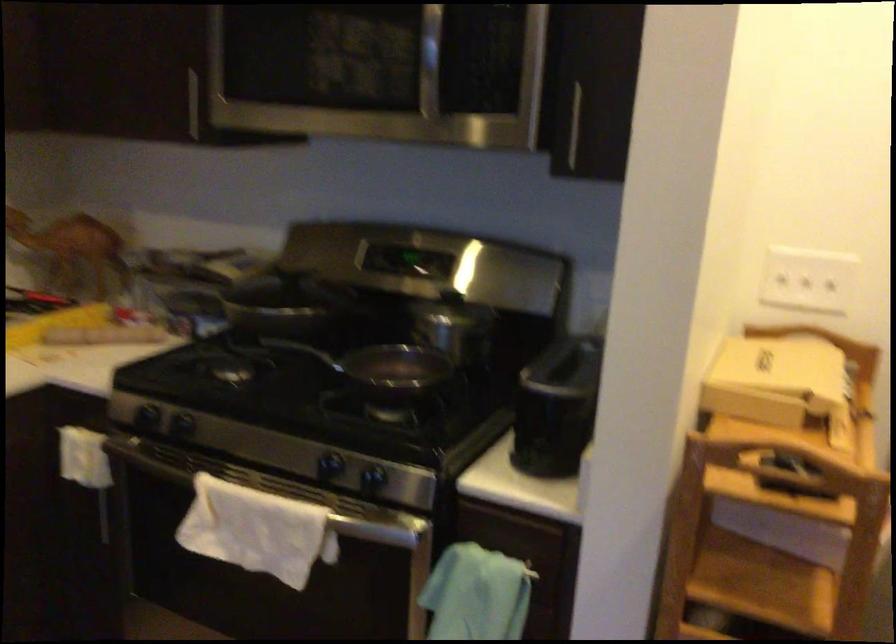
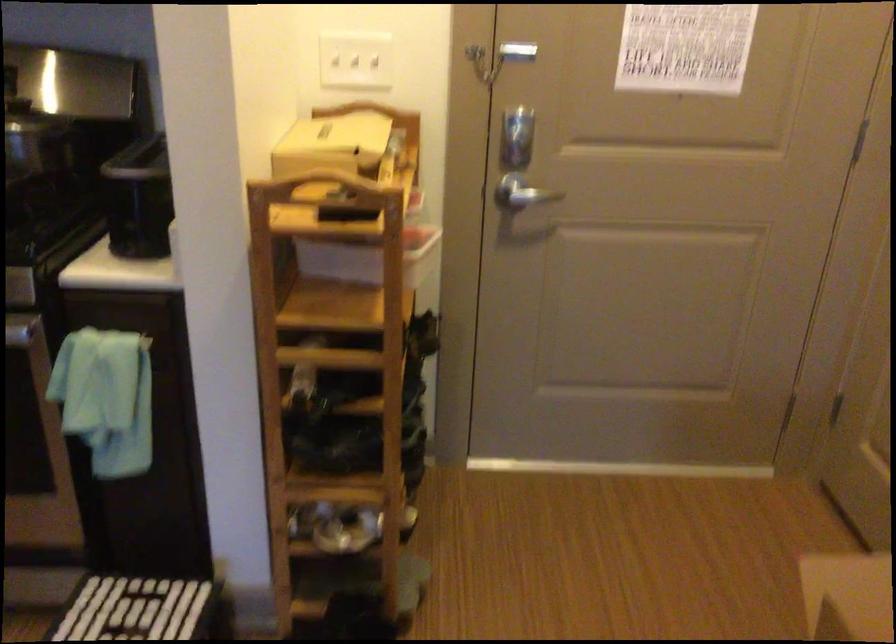
In a continuous first-person perspective shot, in which direction is the camera moving?

The cameraman walked toward right, backward.